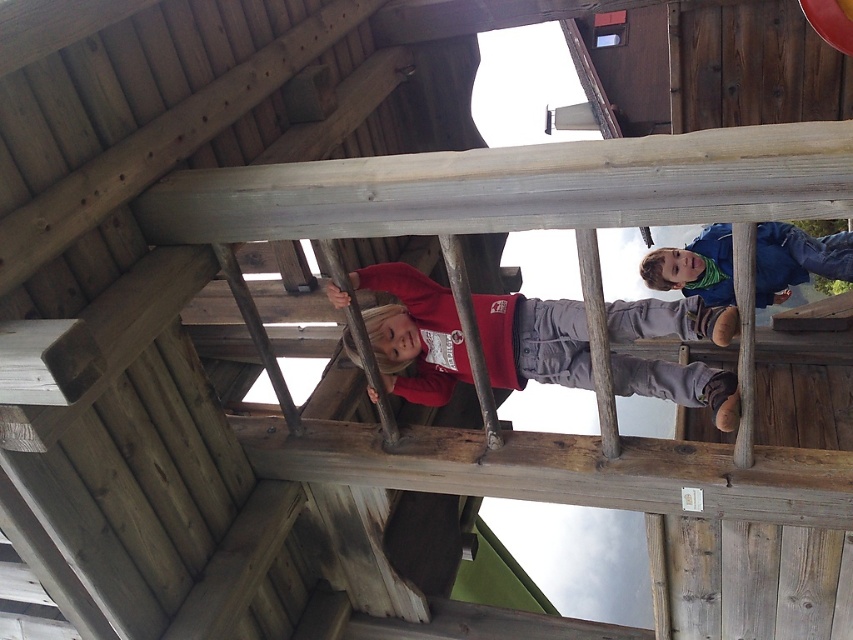
Question: Which object is farther from the camera taking this photo?

Choices:
 (A) matte red hoodie at center
 (B) blue fleece jacket at upper center

Answer: (B)

Question: Which point appears closest to the camera in this image?

Choices:
 (A) (691, 368)
 (B) (685, 266)

Answer: (A)

Question: Does matte red hoodie at center have a larger size compared to blue fleece jacket at upper center?

Choices:
 (A) no
 (B) yes

Answer: (B)

Question: Which point is farther from the camera taking this photo?

Choices:
 (A) (408, 388)
 (B) (799, 278)

Answer: (B)

Question: Is matte red hoodie at center thinner than blue fleece jacket at upper center?

Choices:
 (A) no
 (B) yes

Answer: (A)

Question: Does matte red hoodie at center lie in front of blue fleece jacket at upper center?

Choices:
 (A) no
 (B) yes

Answer: (B)